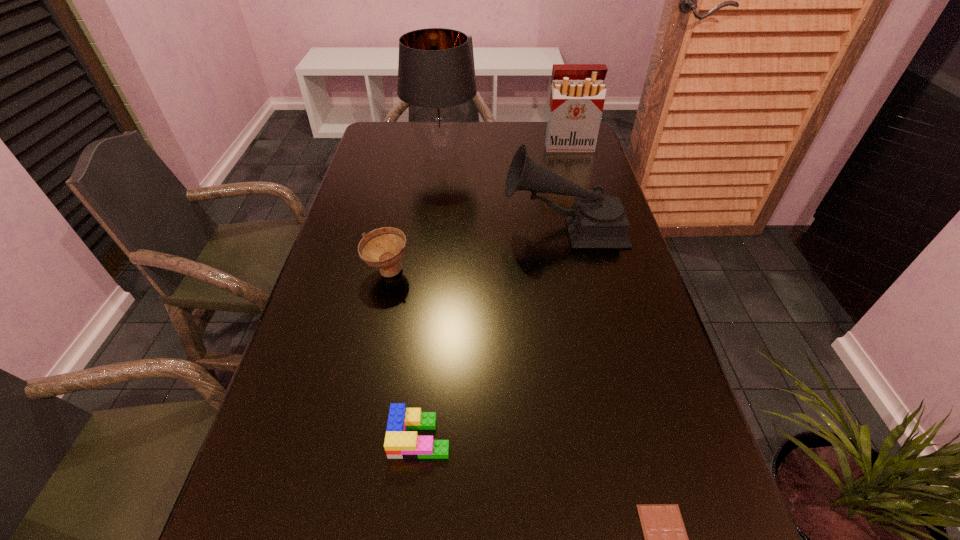
Image resolution: width=960 pixels, height=540 pixels. Find the location of `object at the far left corner`. object at the far left corner is located at coordinates (435, 73).

Where is `object present at the far right corner`? The height and width of the screenshot is (540, 960). object present at the far right corner is located at coordinates (577, 97).

In the image, there is a desktop. Identify the location of blank space at the far edge. This screenshot has width=960, height=540. (510, 125).

Identify the location of vacant space at the right edge of the desktop. (649, 316).

In the image, there is a desktop. At what (x,y) coordinates should I click in order to perform the action: click on vacant space at the far left corner. Please return your answer as a coordinate pair (x, y). The height and width of the screenshot is (540, 960). Looking at the image, I should click on coord(379,126).

Find the location of a particular element. This screenshot has height=540, width=960. free space at the far right corner of the desktop is located at coordinates (553, 154).

At what (x,y) coordinates should I click in order to perform the action: click on empty space between the second shortest object and the phonograph_record. Please return your answer as a coordinate pair (x, y). This screenshot has height=540, width=960. Looking at the image, I should click on (492, 332).

Locate an element on the screen. This screenshot has width=960, height=540. free space between the Lego and the cigarette case is located at coordinates (494, 292).

This screenshot has width=960, height=540. I want to click on vacant area between the phonograph_record and the fifth tallest object, so click(492, 332).

Where is `free spot between the fourth nearest object and the Lego`? This screenshot has width=960, height=540. free spot between the fourth nearest object and the Lego is located at coordinates (492, 332).